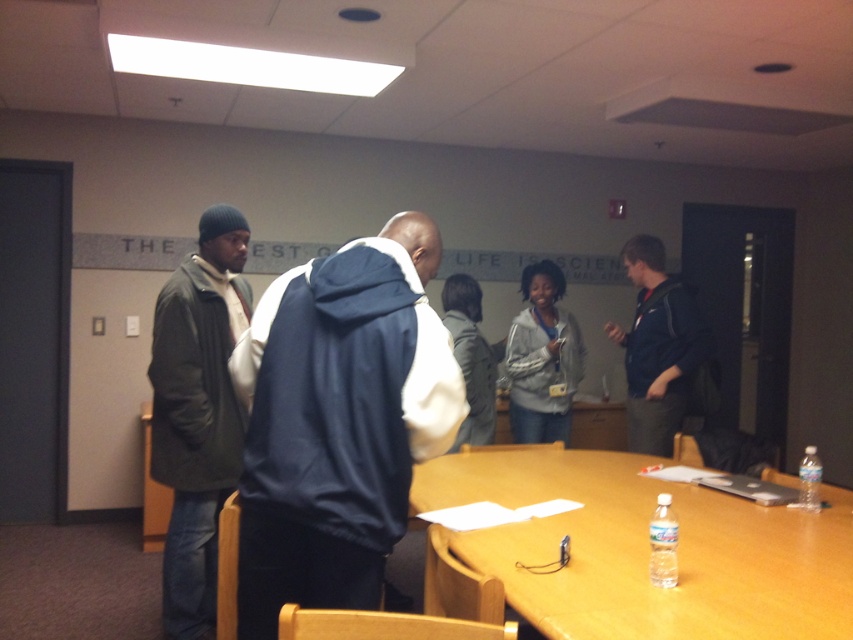
Which of these two, navy blue jacket at center or matte green jacket at left, stands taller?

Standing taller between the two is matte green jacket at left.

Is the position of navy blue jacket at center less distant than that of matte green jacket at left?

Yes, navy blue jacket at center is closer to the viewer.

Which is in front, point (428, 230) or point (192, 268)?

Point (428, 230)

Locate an element on the screen. navy blue jacket at center is located at coordinates (339, 420).

Which of these two, dark blue jacket at center or silver metallic jacket at center, stands shorter?

Standing shorter between the two is silver metallic jacket at center.

Is the position of dark blue jacket at center less distant than that of silver metallic jacket at center?

Yes, it is in front of silver metallic jacket at center.

What are the coordinates of `dark blue jacket at center` in the screenshot? It's located at (657, 348).

Does point (374, 406) come closer to viewer compared to point (572, 332)?

Yes, point (374, 406) is closer to viewer.

Is navy blue jacket at center to the right of silver metallic jacket at center from the viewer's perspective?

In fact, navy blue jacket at center is to the left of silver metallic jacket at center.

Does point (389, 484) lie in front of point (572, 378)?

Yes, it is.

At what (x,y) coordinates should I click in order to perform the action: click on navy blue jacket at center. Please return your answer as a coordinate pair (x, y). Looking at the image, I should click on (339, 420).